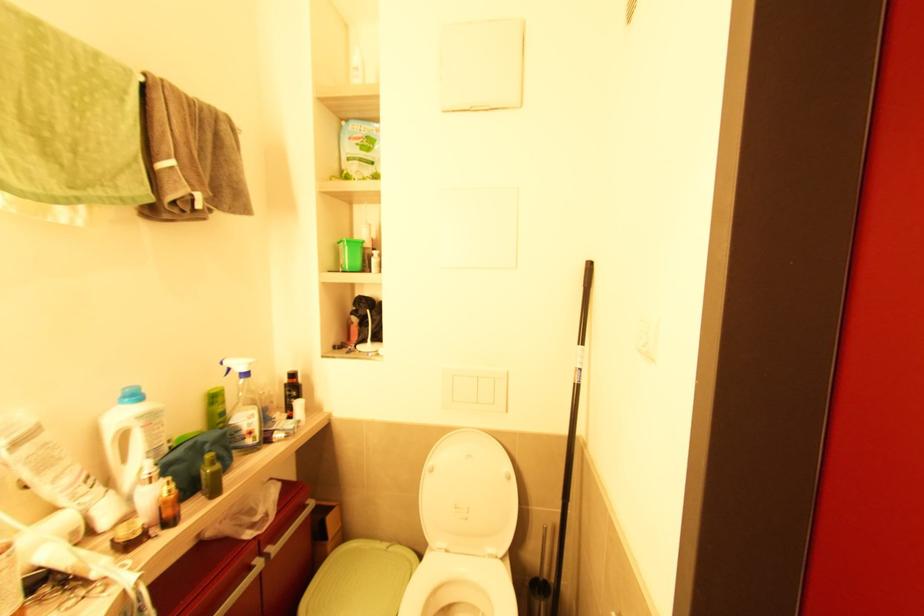
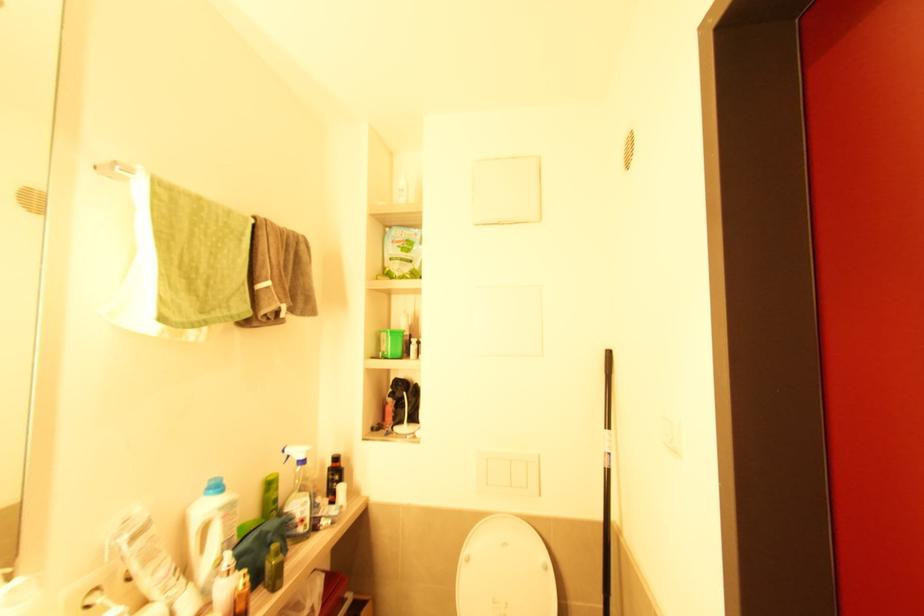
Locate, in the second image, the point that corresponds to point 339,245 in the first image.

(382, 333)